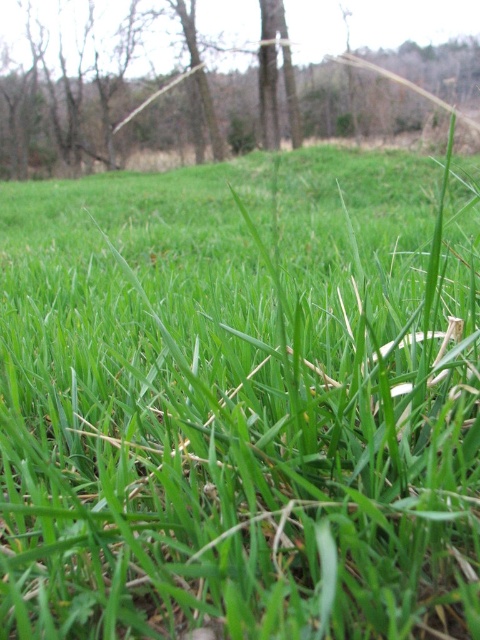
Who is taller, brown wood tree at center or smooth brown tree trunk at center?

brown wood tree at center is taller.

Can you confirm if brown wood tree at center is positioned below smooth brown tree trunk at center?

No, brown wood tree at center is not below smooth brown tree trunk at center.

This screenshot has height=640, width=480. Describe the element at coordinates (374, 22) in the screenshot. I see `brown wood tree at center` at that location.

Image resolution: width=480 pixels, height=640 pixels. I want to click on brown wood tree at center, so [x=374, y=22].